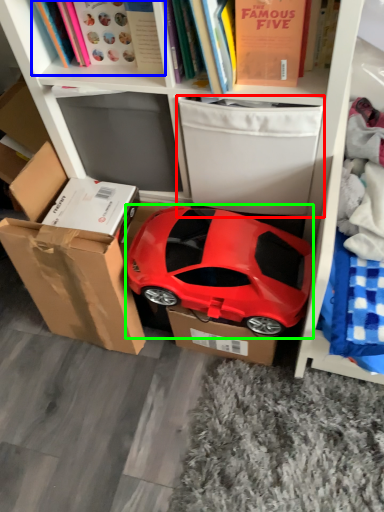
Question: Based on their relative distances, which object is farther from storage box (highlighted by a red box)? Choose from book (highlighted by a blue box) and car (highlighted by a green box).

Choices:
 (A) book
 (B) car

Answer: (A)